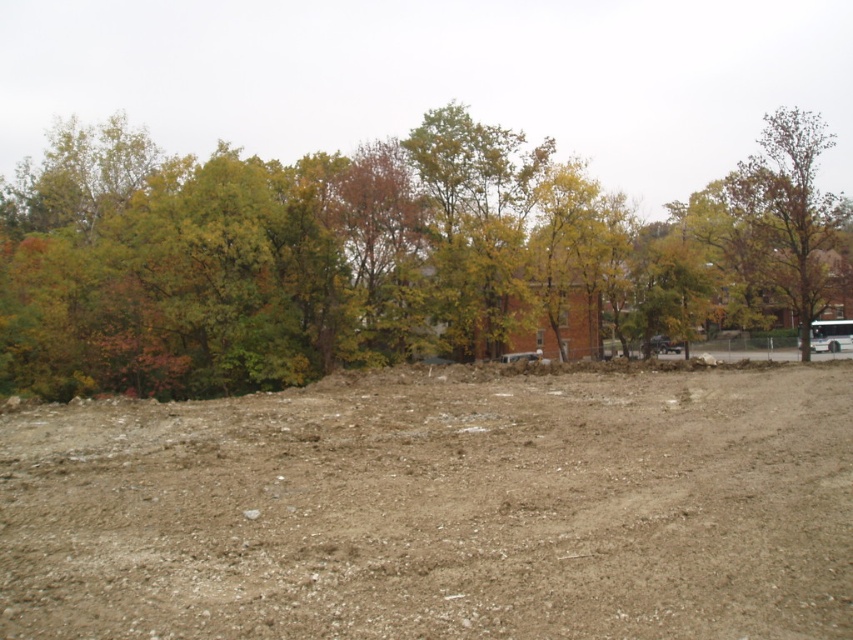
Question: Can you confirm if brown sandy dirt at center is positioned to the right of green leafy tree at upper left?

Choices:
 (A) no
 (B) yes

Answer: (B)

Question: Is brown sandy dirt at center further to the viewer compared to brown textured tree at upper right?

Choices:
 (A) yes
 (B) no

Answer: (B)

Question: Estimate the real-world distances between objects in this image. Which object is farther from the brown textured tree at upper right?

Choices:
 (A) brown sandy dirt at center
 (B) green leafy tree at upper left

Answer: (A)

Question: Is green leafy tree at upper left further to camera compared to brown textured tree at upper right?

Choices:
 (A) yes
 (B) no

Answer: (B)

Question: Which point is closer to the camera?

Choices:
 (A) brown sandy dirt at center
 (B) brown textured tree at upper right

Answer: (A)

Question: Which point appears farthest from the camera in this image?

Choices:
 (A) (819, 120)
 (B) (166, 429)

Answer: (A)